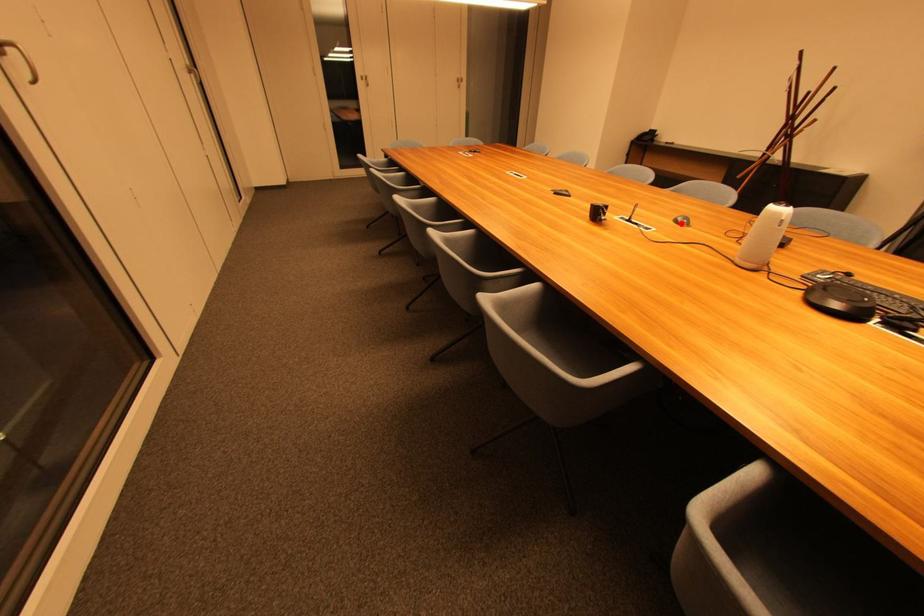
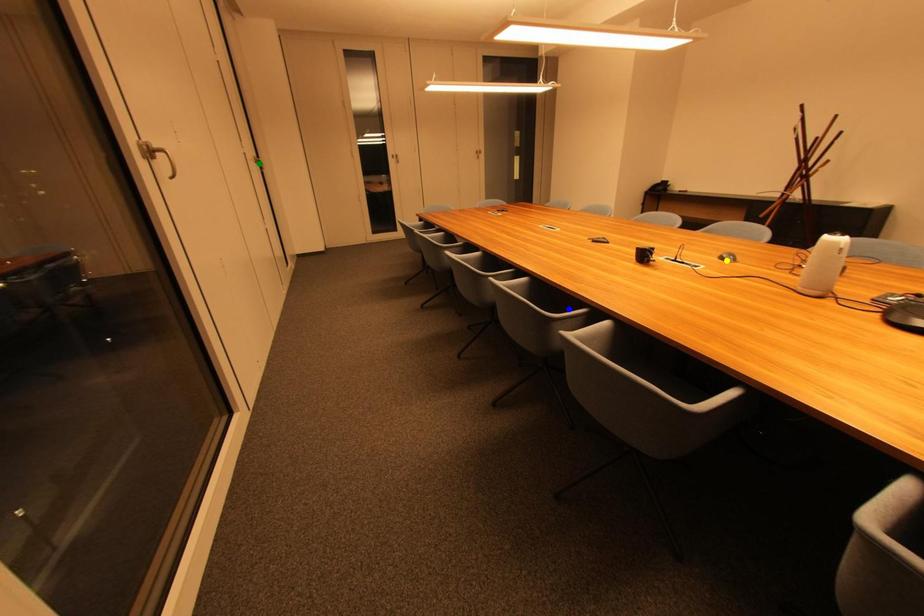
Question: I am providing you with two images of the same scene from different viewpoints. A red point is marked on the first image. You are given multiple points on the second image. Can you choose the point in image 2 that corresponds to the point in image 1?

Choices:
 (A) blue point
 (B) yellow point
 (C) green point

Answer: (B)